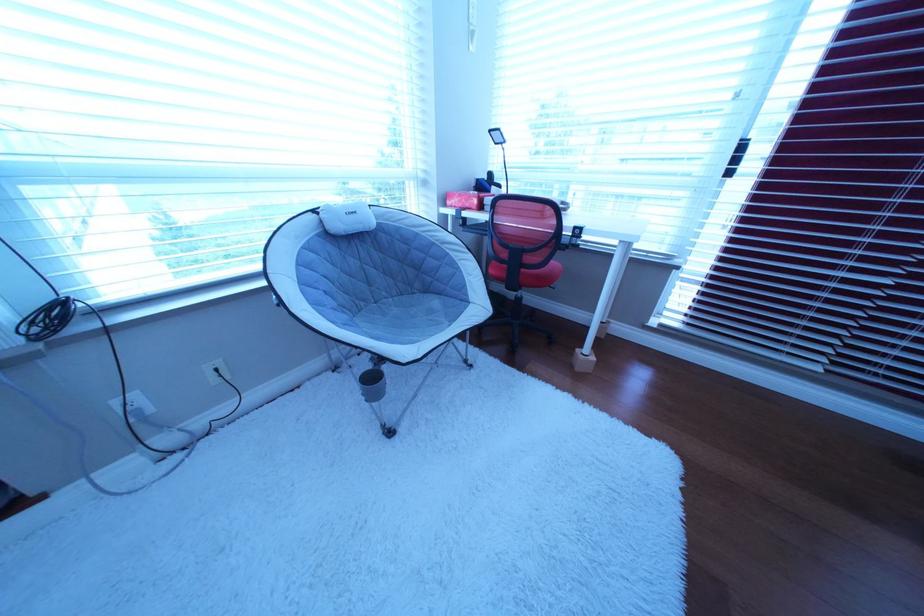
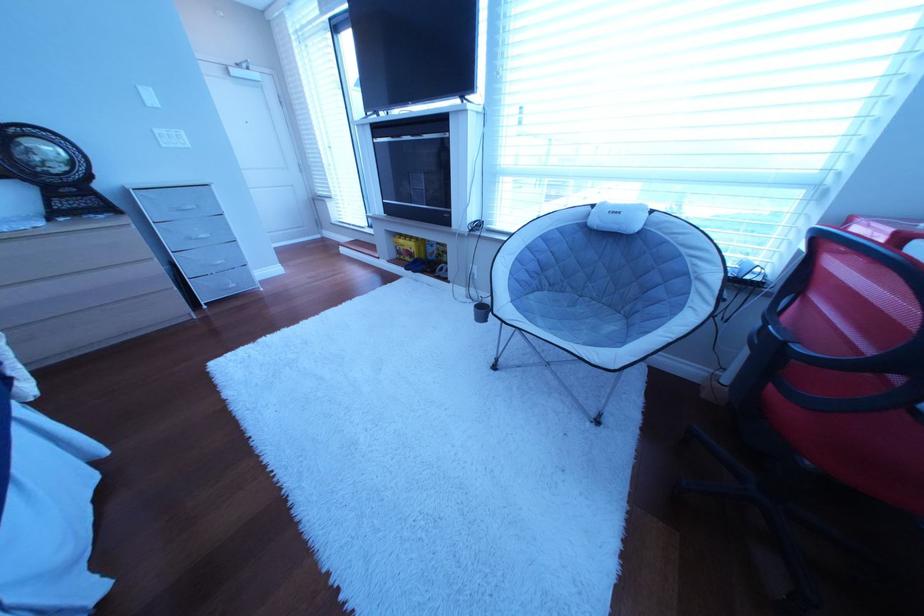
Where in the second image is the point corresponding to [370,318] from the first image?

(565, 293)